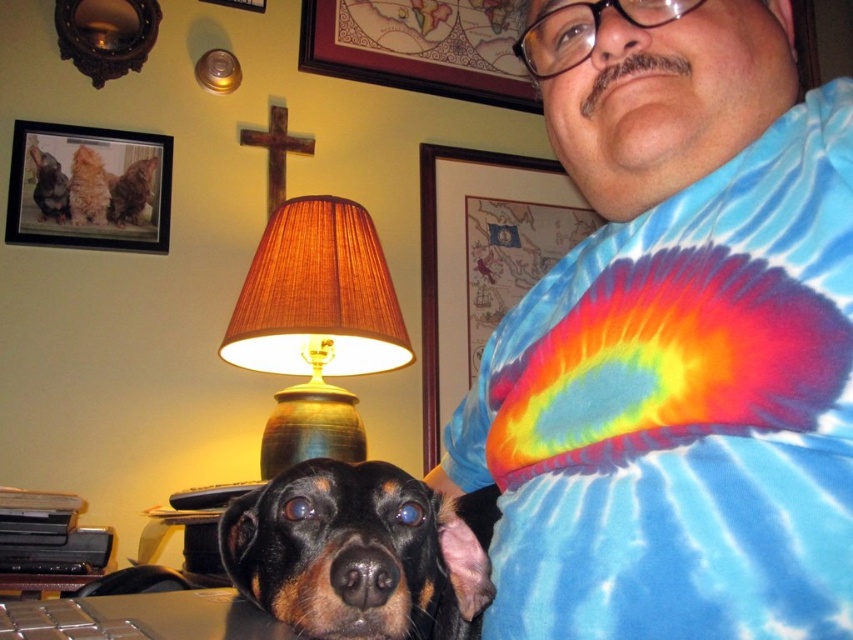
Looking at this image, you are standing at the origin point in the image and want to move towards the black fur dog at center. What direction should you move in to reach it?

The black fur dog at center is located at point 0.866 on the x axis and 0.422 on the y axis. Since you are at the origin point, you should move towards the right and slightly upward to reach the black fur dog at center.

Consider the image. You are designing a layout for a magazine article and need to place the brown fabric lampshade at upper center and the wooden frame at upper left in the image. Which object should you place first if you want to ensure there is enough space for both?

The brown fabric lampshade at upper center should be placed first because it is bigger than the wooden frame at upper left, ensuring there is enough space for both.